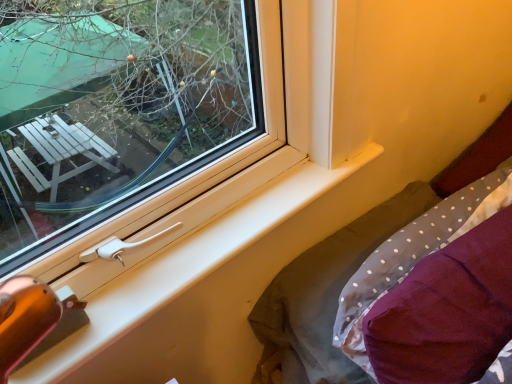
Question: Does gray polka dot fabric at lower right have a lesser width compared to maroon fabric pillow at lower right?

Choices:
 (A) no
 (B) yes

Answer: (A)

Question: Can you confirm if gray polka dot fabric at lower right is taller than maroon fabric pillow at lower right?

Choices:
 (A) yes
 (B) no

Answer: (A)

Question: From a real-world perspective, is gray polka dot fabric at lower right on top of maroon fabric pillow at lower right?

Choices:
 (A) no
 (B) yes

Answer: (A)

Question: Is gray polka dot fabric at lower right positioned beyond the bounds of maroon fabric pillow at lower right?

Choices:
 (A) no
 (B) yes

Answer: (B)

Question: Can you confirm if gray polka dot fabric at lower right is positioned to the left of maroon fabric pillow at lower right?

Choices:
 (A) yes
 (B) no

Answer: (A)

Question: In the image, is maroon fabric pillow at lower right on the left side or the right side of white plastic window sill at lower left?

Choices:
 (A) right
 (B) left

Answer: (A)

Question: Does point (500, 274) appear closer or farther from the camera than point (231, 223)?

Choices:
 (A) closer
 (B) farther

Answer: (A)

Question: Considering their positions, is maroon fabric pillow at lower right located in front of or behind white plastic window sill at lower left?

Choices:
 (A) behind
 (B) front

Answer: (B)

Question: From the image's perspective, relative to white plastic window sill at lower left, is maroon fabric pillow at lower right above or below?

Choices:
 (A) above
 (B) below

Answer: (B)

Question: Considering the positions of white plastic window sill at lower left and maroon fabric pillow at lower right in the image, is white plastic window sill at lower left wider or thinner than maroon fabric pillow at lower right?

Choices:
 (A) wide
 (B) thin

Answer: (B)

Question: Do you think white plastic window sill at lower left is within maroon fabric pillow at lower right, or outside of it?

Choices:
 (A) inside
 (B) outside

Answer: (B)

Question: Considering the positions of point (167, 264) and point (474, 238), is point (167, 264) closer or farther from the camera than point (474, 238)?

Choices:
 (A) farther
 (B) closer

Answer: (B)

Question: From the image's perspective, is white plastic window sill at lower left positioned above or below maroon fabric pillow at lower right?

Choices:
 (A) above
 (B) below

Answer: (A)

Question: In terms of width, does gray polka dot fabric at lower right look wider or thinner when compared to maroon fabric pillow at lower right?

Choices:
 (A) thin
 (B) wide

Answer: (B)

Question: Looking at the image, does gray polka dot fabric at lower right seem bigger or smaller compared to maroon fabric pillow at lower right?

Choices:
 (A) small
 (B) big

Answer: (B)